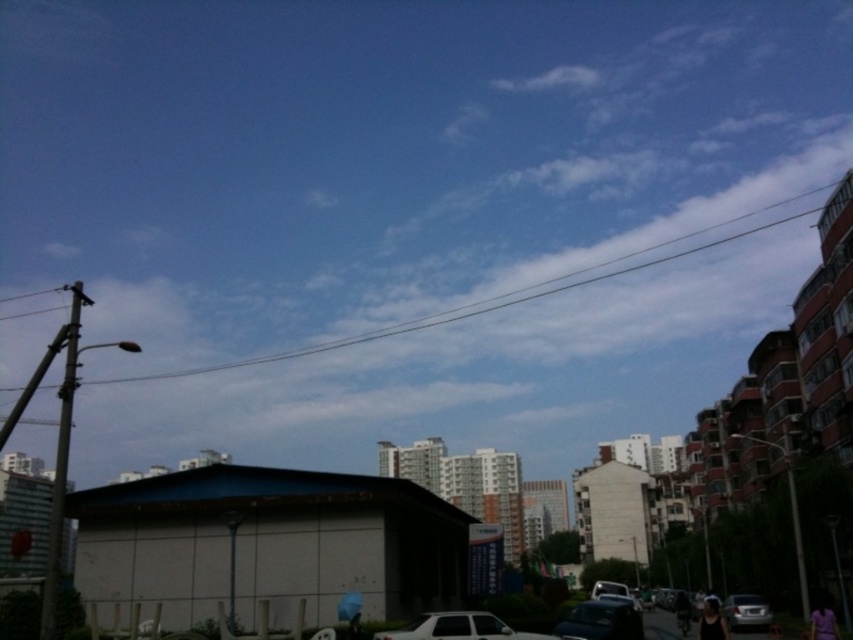
Locate an element on the screen. Image resolution: width=853 pixels, height=640 pixels. white matte car at lower center is located at coordinates (457, 627).

Which is in front, point (525, 634) or point (755, 625)?

Point (525, 634) is in front.

Measure the distance between point (416,636) and camera.

A distance of 81.66 feet exists between point (416,636) and camera.

What are the coordinates of `white matte car at lower center` in the screenshot? It's located at (457, 627).

Is shiny black car at center smaller than satin silver sedan at lower right?

Correct, shiny black car at center occupies less space than satin silver sedan at lower right.

Does shiny black car at center have a lesser height compared to satin silver sedan at lower right?

Indeed, shiny black car at center has a lesser height compared to satin silver sedan at lower right.

Who is more distant from viewer, (563, 637) or (740, 612)?

The point (740, 612) is behind.

Where is `shiny black car at center`? Image resolution: width=853 pixels, height=640 pixels. shiny black car at center is located at coordinates pyautogui.click(x=601, y=620).

Who is lower down, white matte car at lower center or shiny black car at center?

shiny black car at center is lower down.

From the picture: How far apart are white matte car at lower center and shiny black car at center?

The distance of white matte car at lower center from shiny black car at center is 4.57 meters.

Find the location of `white matte car at lower center`. white matte car at lower center is located at coordinates (457, 627).